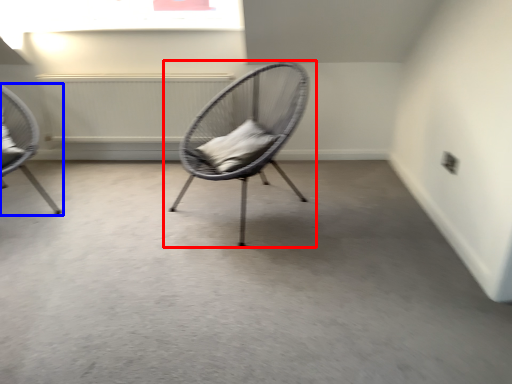
Question: Which object is further to the camera taking this photo, chair (highlighted by a red box) or chair (highlighted by a blue box)?

Choices:
 (A) chair
 (B) chair

Answer: (B)